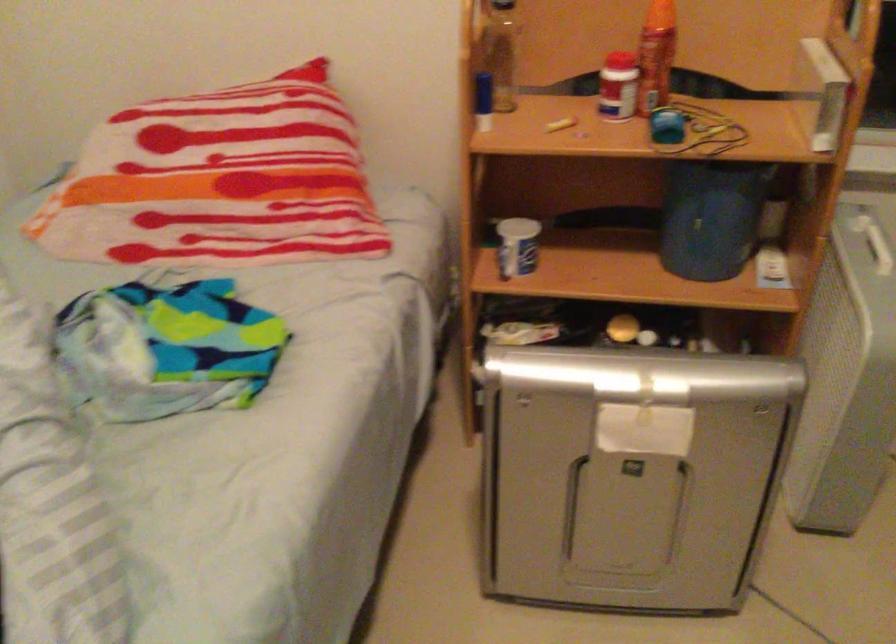
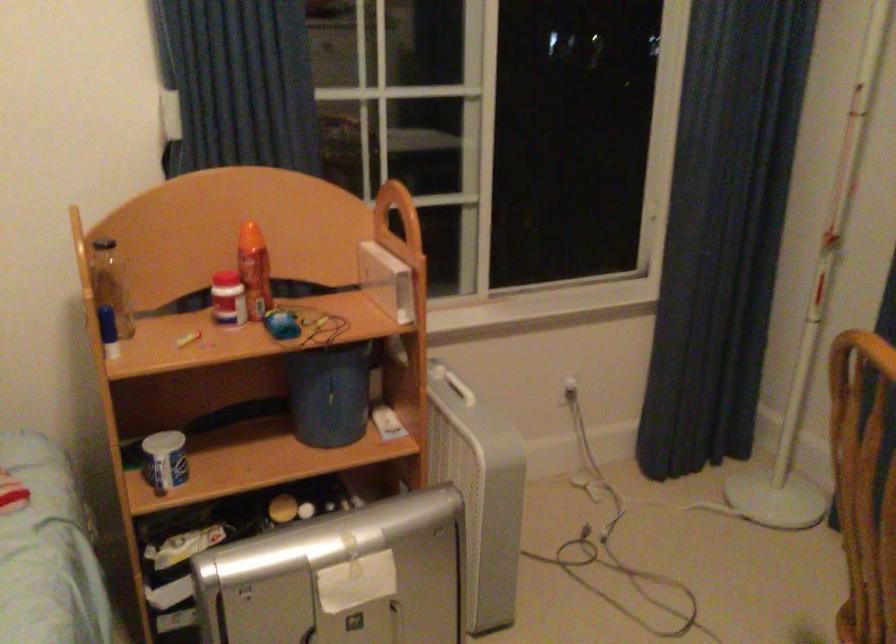
Where in the second image is the point corresponding to [510,247] from the first image?

(165, 460)